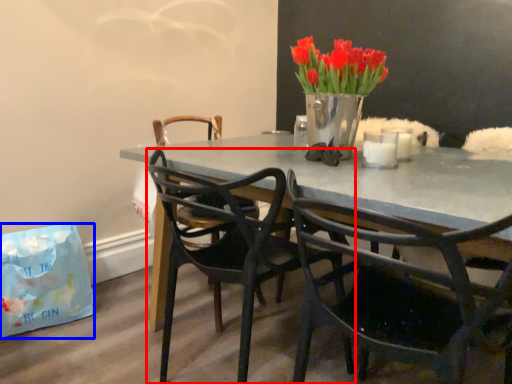
Question: Which point is closer to the camera, chair (highlighted by a red box) or handbag (highlighted by a blue box)?

Choices:
 (A) chair
 (B) handbag

Answer: (A)